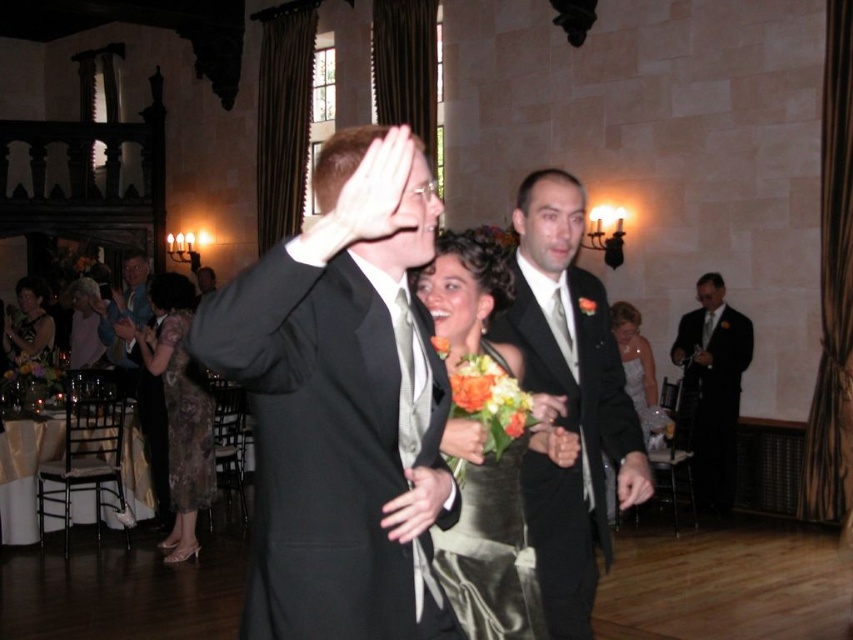
Question: Which object appears closest to the camera in this image?

Choices:
 (A) printed silk dress at left
 (B) black satin suit at center
 (C) light blue suit at left

Answer: (B)

Question: Among these points, which one is farthest from the camera?

Choices:
 (A) (490, 538)
 (B) (30, 300)

Answer: (B)

Question: Which object appears farthest from the camera in this image?

Choices:
 (A) black satin suit at center
 (B) printed silk dress at left
 (C) shiny black suit at center

Answer: (B)

Question: Does printed silk dress at lower left appear over light blue suit at left?

Choices:
 (A) yes
 (B) no

Answer: (A)

Question: Is matte black suit at right smaller than light pink fabric dress at upper left?

Choices:
 (A) no
 (B) yes

Answer: (B)

Question: Does printed silk dress at left have a greater width compared to light pink fabric dress at upper left?

Choices:
 (A) no
 (B) yes

Answer: (A)